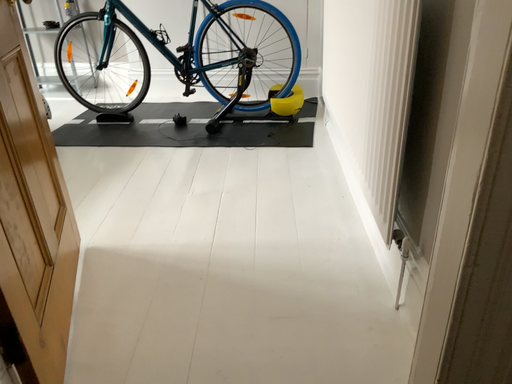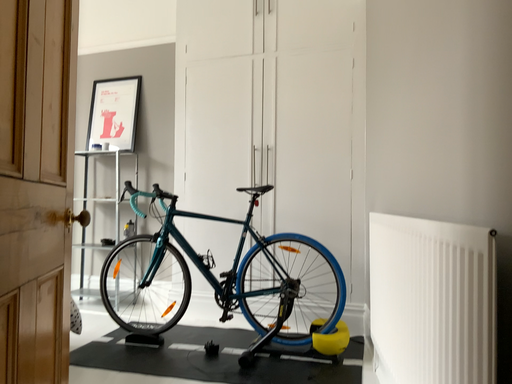
Question: Which way did the camera rotate in the video?

Choices:
 (A) rotated downward
 (B) rotated upward

Answer: (B)